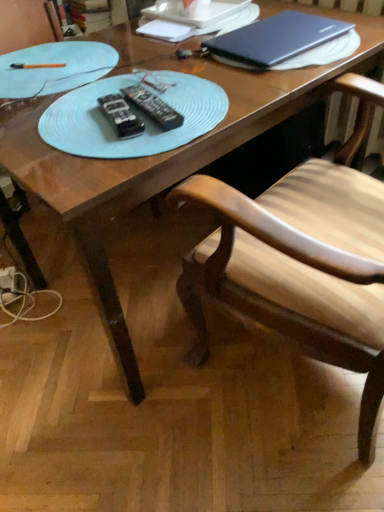
Question: Which direction should I rotate to look at black plastic remote at center, the first remote positioned from the left, — up or down?

Choices:
 (A) up
 (B) down

Answer: (A)

Question: Considering the relative positions of wooden chair at center and satin black laptop at upper right in the image provided, is wooden chair at center behind satin black laptop at upper right?

Choices:
 (A) yes
 (B) no

Answer: (B)

Question: Considering the relative positions of wooden chair at center and satin black laptop at upper right in the image provided, is wooden chair at center in front of satin black laptop at upper right?

Choices:
 (A) yes
 (B) no

Answer: (A)

Question: Does wooden chair at center have a larger size compared to satin black laptop at upper right?

Choices:
 (A) yes
 (B) no

Answer: (A)

Question: Can we say wooden chair at center lies outside satin black laptop at upper right?

Choices:
 (A) yes
 (B) no

Answer: (A)

Question: Does wooden chair at center have a smaller size compared to satin black laptop at upper right?

Choices:
 (A) no
 (B) yes

Answer: (A)

Question: Can you confirm if wooden chair at center is taller than satin black laptop at upper right?

Choices:
 (A) yes
 (B) no

Answer: (A)

Question: Is wooden chair at center wider than light blue plastic plate at upper left?

Choices:
 (A) yes
 (B) no

Answer: (A)

Question: Is wooden chair at center at the right side of light blue plastic plate at upper left?

Choices:
 (A) yes
 (B) no

Answer: (A)

Question: Could you tell me if wooden chair at center is turned towards light blue plastic plate at upper left?

Choices:
 (A) yes
 (B) no

Answer: (A)

Question: Is wooden chair at center at the left side of light blue plastic plate at upper left?

Choices:
 (A) yes
 (B) no

Answer: (B)

Question: Is light blue plastic plate at upper left located within wooden chair at center?

Choices:
 (A) no
 (B) yes

Answer: (A)

Question: Is wooden chair at center outside of light blue plastic plate at upper left?

Choices:
 (A) yes
 (B) no

Answer: (A)

Question: Does wooden chair at center have a smaller size compared to black plastic remote at center, positioned as the 2th remote in left-to-right order?

Choices:
 (A) no
 (B) yes

Answer: (A)